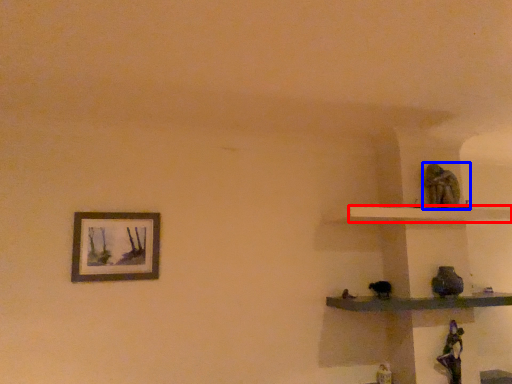
Question: Which object is further to the camera taking this photo, shelf (highlighted by a red box) or statue (highlighted by a blue box)?

Choices:
 (A) shelf
 (B) statue

Answer: (B)